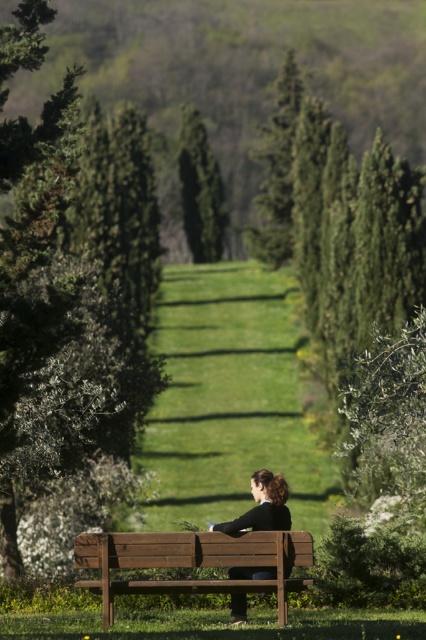
Does green textured tree at center have a greater height compared to black leather jacket at center?

Indeed, green textured tree at center has a greater height compared to black leather jacket at center.

The image size is (426, 640). I want to click on green textured tree at center, so click(199, 189).

Which is in front, point (120, 406) or point (267, 484)?

Positioned in front is point (267, 484).

Which is below, green leafy tree at left or black leather jacket at center?

Positioned lower is black leather jacket at center.

Is point (88, 288) farther from camera compared to point (233, 522)?

Yes.

Find the location of `green leafy tree at left`. green leafy tree at left is located at coordinates (55, 326).

Is green leafy tree at left positioned before green textured tree at center?

That is True.

Is green leafy tree at left bigger than green textured tree at center?

Indeed, green leafy tree at left has a larger size compared to green textured tree at center.

Who is more forward, (106, 428) or (224, 212)?

Point (106, 428)

Where is `green leafy tree at left`? The height and width of the screenshot is (640, 426). green leafy tree at left is located at coordinates (55, 326).